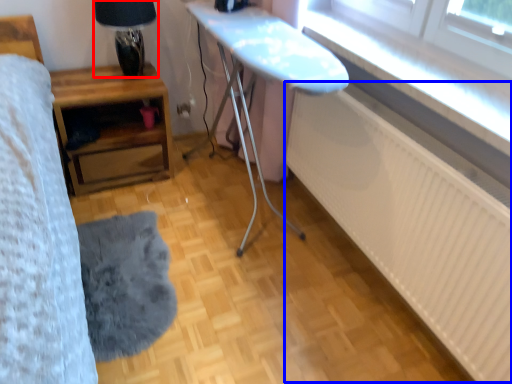
Question: Which point is closer to the camera, table lamp (highlighted by a red box) or radiator (highlighted by a blue box)?

Choices:
 (A) table lamp
 (B) radiator

Answer: (B)